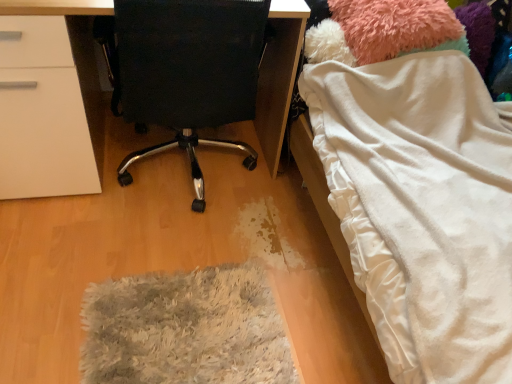
Question: In terms of height, does gray shaggy rug at lower center look taller or shorter compared to fuzzy pink teddy at upper right?

Choices:
 (A) short
 (B) tall

Answer: (A)

Question: Is gray shaggy rug at lower center inside or outside of fuzzy pink teddy at upper right?

Choices:
 (A) inside
 (B) outside

Answer: (B)

Question: Which object is the farthest from the fuzzy pink teddy at upper right?

Choices:
 (A) black fabric chair at center
 (B) gray shaggy rug at lower center
 (C) white soft blanket at right

Answer: (B)

Question: Which object is the closest to the fuzzy pink teddy at upper right?

Choices:
 (A) gray shaggy rug at lower center
 (B) black fabric chair at center
 (C) white soft blanket at right

Answer: (C)